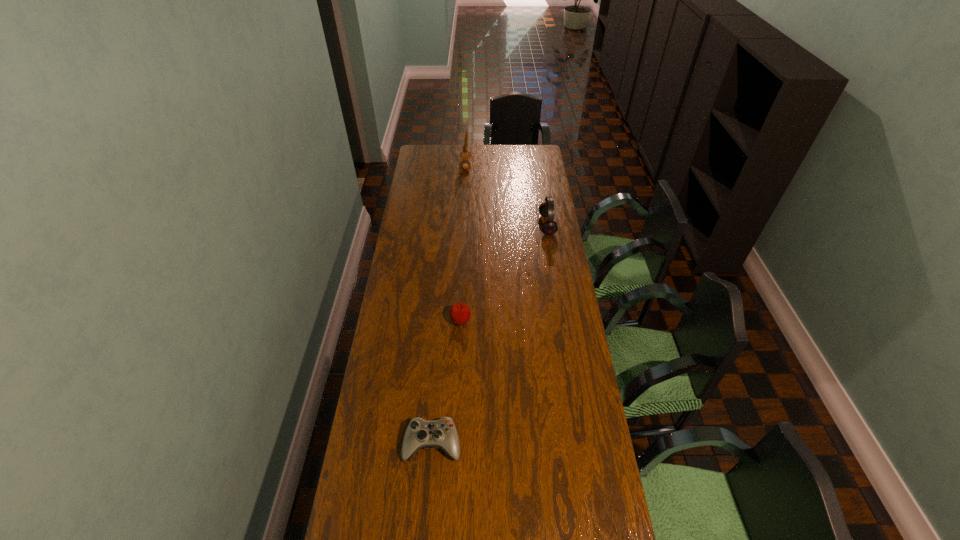
Identify the location of the left earphone. The image size is (960, 540). (465, 155).

At what (x,y) coordinates should I click in order to perform the action: click on the farther earphone. Please return your answer as a coordinate pair (x, y). Image resolution: width=960 pixels, height=540 pixels. Looking at the image, I should click on coord(465,155).

This screenshot has height=540, width=960. Identify the location of the right earphone. (546, 209).

At what (x,y) coordinates should I click in order to perform the action: click on the nearer earphone. Please return your answer as a coordinate pair (x, y). Looking at the image, I should click on (546, 209).

The image size is (960, 540). Identify the location of apple. (460, 313).

At what (x,y) coordinates should I click in order to perform the action: click on control. Please return your answer as a coordinate pair (x, y). The width and height of the screenshot is (960, 540). Looking at the image, I should click on (420, 433).

The width and height of the screenshot is (960, 540). I want to click on the shortest object, so click(420, 433).

Image resolution: width=960 pixels, height=540 pixels. I want to click on vacant space positioned on the front-facing side of the taller earphone, so click(494, 165).

Where is `vacant space located 0.380m on the ear cups of the third nearest object`? vacant space located 0.380m on the ear cups of the third nearest object is located at coordinates (460, 225).

This screenshot has height=540, width=960. I want to click on free point located 0.160m on the ear cups of the third nearest object, so (506, 225).